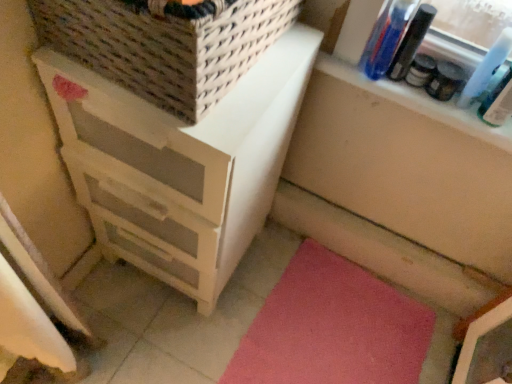
Question: Can you confirm if white wood chest of drawers at left is bigger than clear plastic bottles at upper right?

Choices:
 (A) yes
 (B) no

Answer: (A)

Question: Is white wood chest of drawers at left directly adjacent to clear plastic bottles at upper right?

Choices:
 (A) no
 (B) yes

Answer: (A)

Question: Is white wood chest of drawers at left at the left side of clear plastic bottles at upper right?

Choices:
 (A) yes
 (B) no

Answer: (A)

Question: Is white wood chest of drawers at left in front of clear plastic bottles at upper right?

Choices:
 (A) no
 (B) yes

Answer: (B)

Question: Are white wood chest of drawers at left and clear plastic bottles at upper right located far from each other?

Choices:
 (A) yes
 (B) no

Answer: (B)

Question: Can you confirm if white wood chest of drawers at left is wider than clear plastic bottles at upper right?

Choices:
 (A) no
 (B) yes

Answer: (B)

Question: Does woven beige basket at upper left have a greater height compared to white wood chest of drawers at left?

Choices:
 (A) no
 (B) yes

Answer: (A)

Question: Is woven beige basket at upper left beside white wood chest of drawers at left?

Choices:
 (A) no
 (B) yes

Answer: (A)

Question: From a real-world perspective, is woven beige basket at upper left on white wood chest of drawers at left?

Choices:
 (A) no
 (B) yes

Answer: (B)

Question: Is woven beige basket at upper left at the left side of white wood chest of drawers at left?

Choices:
 (A) no
 (B) yes

Answer: (A)

Question: Can you confirm if woven beige basket at upper left is shorter than white wood chest of drawers at left?

Choices:
 (A) yes
 (B) no

Answer: (A)

Question: Is white wood chest of drawers at left located within woven beige basket at upper left?

Choices:
 (A) no
 (B) yes

Answer: (A)

Question: Is pink carpet at lower right positioned with its back to clear plastic bottles at upper right?

Choices:
 (A) no
 (B) yes

Answer: (A)